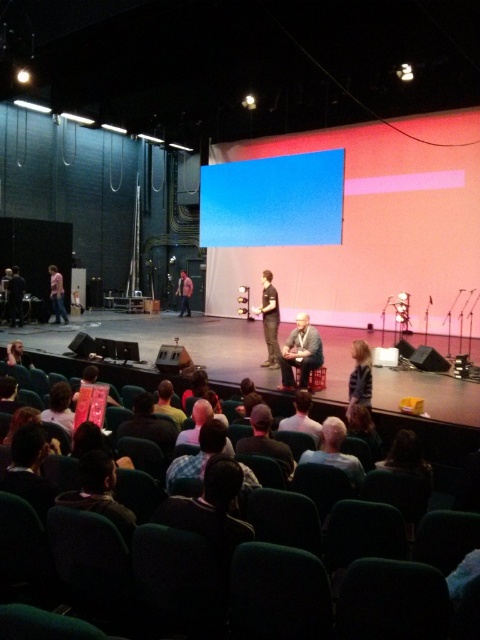
You are sitting in the audience and want to know what is at the exact center of the image. According to the coordinates provided, what is located at point (269, 320)?

The point (269, 320) indicates dark gray pants at center.

You are an attendee sitting at point (252, 243) and need to exit the room quickly. The nearest exit is located behind point (182, 289). Can you easily reach the exit without moving past the other point?

Point (252, 243) is in front of point (182, 289). Since the exit is behind point (182, 289), you would need to move past point (182, 289) to reach it, so it might not be easy to exit without moving past the other point.

You are an event organizer preparing to take a photo of the conference speakers. You notice the dark gray pants at center and the dark brown leather jacket at lower left in the frame. Which clothing item should you adjust to ensure both are clearly visible in the photo?

The dark gray pants at center is larger in size than the dark brown leather jacket at lower left, so you should adjust the dark gray pants at center to ensure both are clearly visible in the photo.